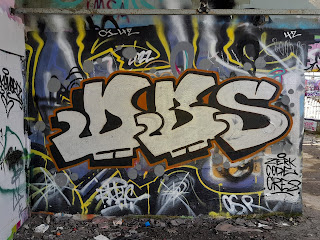
At what (x,y) coordinates should I click in order to perform the action: click on 1 right wall. Please return your answer as a coordinate pair (x, y). The width and height of the screenshot is (320, 240). Looking at the image, I should click on (315, 105).